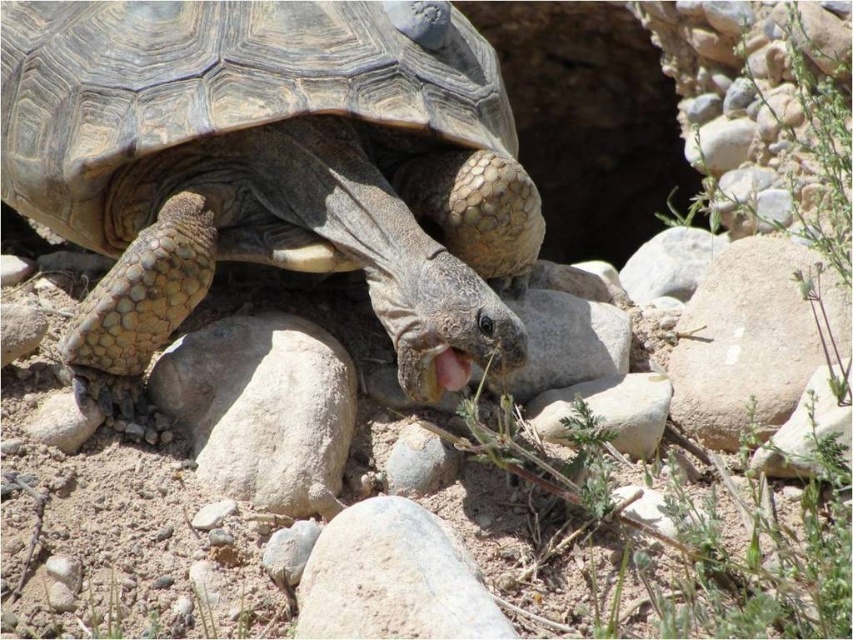
Is leathery brown tortoise at center positioned in front of gray rough rock at center?

No, leathery brown tortoise at center is behind gray rough rock at center.

Can you confirm if leathery brown tortoise at center is shorter than gray rough rock at center?

In fact, leathery brown tortoise at center may be taller than gray rough rock at center.

Where is `leathery brown tortoise at center`? leathery brown tortoise at center is located at coordinates (270, 166).

Who is lower down, leathery brown tortoise at center or gray rough rock at lower center?

gray rough rock at lower center is below.

Who is shorter, leathery brown tortoise at center or gray rough rock at lower center?

Standing shorter between the two is gray rough rock at lower center.

Does point (177, 188) come behind point (398, 563)?

Yes, it is.

Identify the location of leathery brown tortoise at center. Image resolution: width=853 pixels, height=640 pixels. (270, 166).

Measure the distance between point (x=225, y=486) and camera.

A distance of 5.25 feet exists between point (x=225, y=486) and camera.

This screenshot has width=853, height=640. Identify the location of gray rough rock at center. (260, 406).